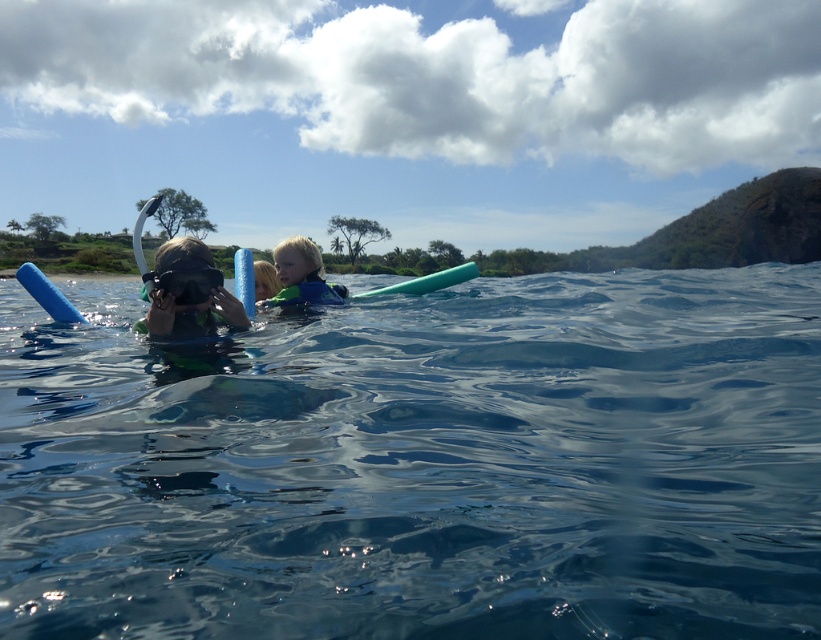
You are a lifeguard on duty and need to retrieve an object from the water. You see a blue rubber ring at center and a camera. Which object is closer to you?

The blue rubber ring at center is closer to you because the distance between them is 22.26 feet, so the blue rubber ring at center is nearer than the camera.